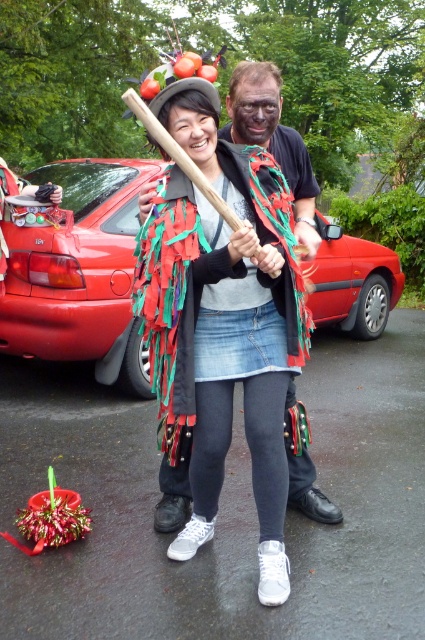
Question: Can you confirm if red matte car at center is positioned to the right of multicolored fabric cape at center?

Choices:
 (A) no
 (B) yes

Answer: (A)

Question: Among these points, which one is farthest from the camera?

Choices:
 (A) (223, 136)
 (B) (99, 320)

Answer: (B)

Question: Is red matte car at center thinner than multicolored fabric cape at center?

Choices:
 (A) no
 (B) yes

Answer: (A)

Question: Which point is closer to the camera?

Choices:
 (A) (85, 346)
 (B) (306, 468)

Answer: (B)

Question: Can you confirm if red matte car at center is thinner than multicolored fabric cape at center?

Choices:
 (A) no
 (B) yes

Answer: (A)

Question: Which of the following is the closest to the observer?

Choices:
 (A) (328, 316)
 (B) (167, 464)

Answer: (B)